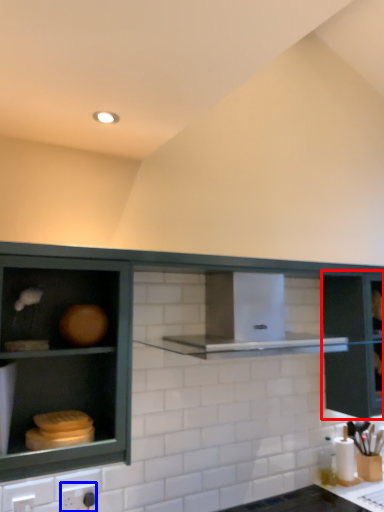
Question: Among these objects, which one is nearest to the camera, glass door (highlighted by a red box) or electric outlet (highlighted by a blue box)?

Choices:
 (A) glass door
 (B) electric outlet

Answer: (B)